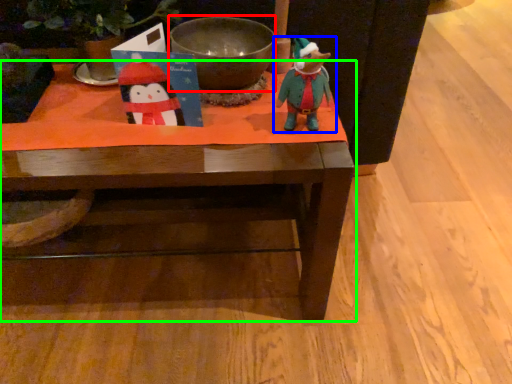
Question: Considering the real-world distances, which object is farthest from bowl (highlighted by a red box)? toy (highlighted by a blue box) or table (highlighted by a green box)?

Choices:
 (A) toy
 (B) table

Answer: (B)